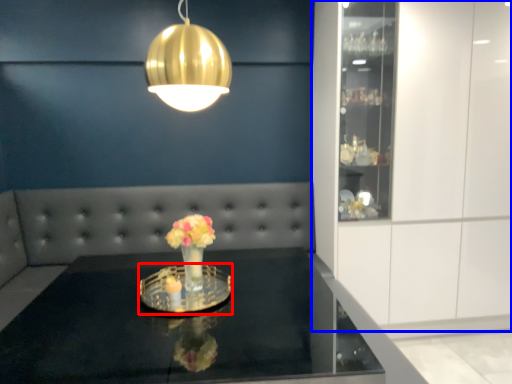
Question: Among these objects, which one is nearest to the camera, glass plate (highlighted by a red box) or cabinetry (highlighted by a blue box)?

Choices:
 (A) glass plate
 (B) cabinetry

Answer: (A)